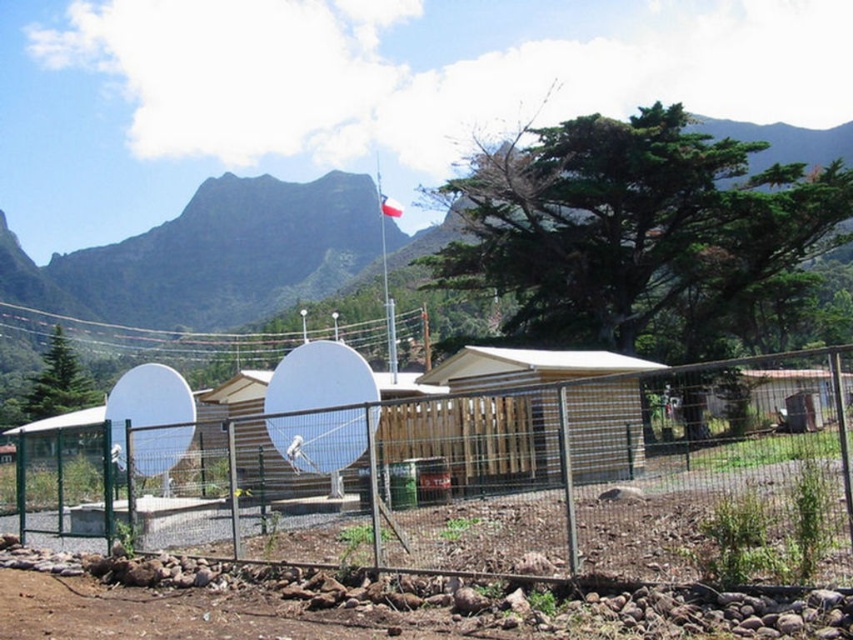
Question: Which object is closer to the camera taking this photo?

Choices:
 (A) green wire mesh fence at center
 (B) white matte satellite dish at center

Answer: (A)

Question: Is the position of green grassy mountain at upper center more distant than that of wooden hut at center?

Choices:
 (A) no
 (B) yes

Answer: (B)

Question: Does wooden hut at center appear over white fabric flag at upper center?

Choices:
 (A) no
 (B) yes

Answer: (A)

Question: Which object appears closest to the camera in this image?

Choices:
 (A) wooden hut at center
 (B) green wire mesh fence at center
 (C) white fabric flag at upper center
 (D) white matte satellite dish at center

Answer: (B)

Question: Which object is farther from the camera taking this photo?

Choices:
 (A) white plastic flagpole at center
 (B) white matte satellite dish at center

Answer: (A)

Question: Does green wire mesh fence at center have a larger size compared to white fabric flag at upper center?

Choices:
 (A) yes
 (B) no

Answer: (B)